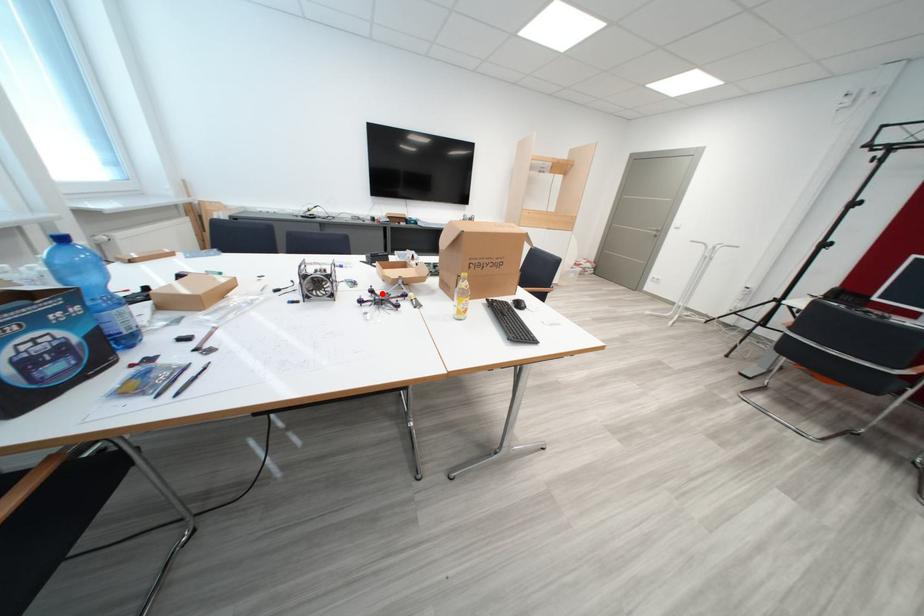
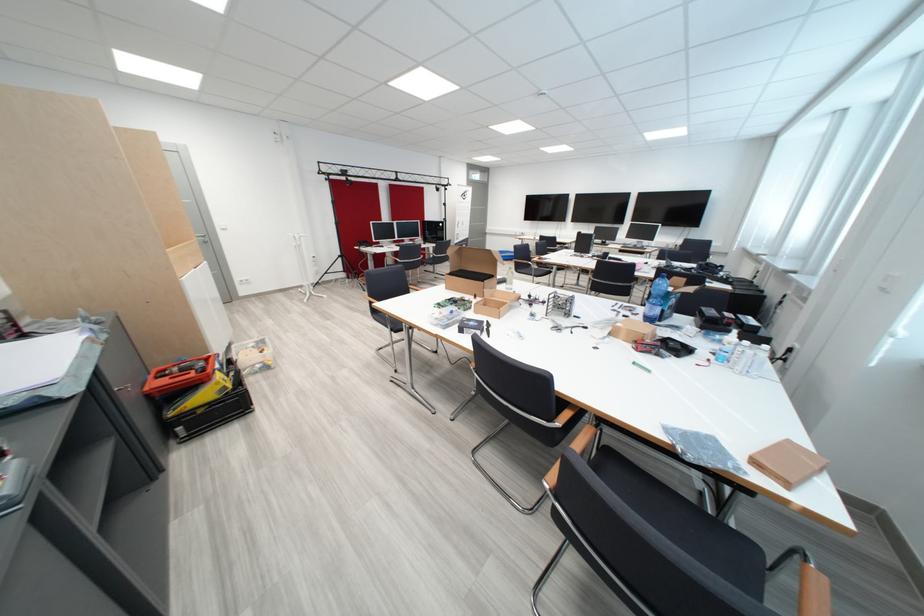
Question: I am providing you with two images of the same scene from different viewpoints. A red point is marked on the first image. At the location where the point appears in image 1, is it still visible in image 2?

Choices:
 (A) Yes
 (B) No

Answer: (B)